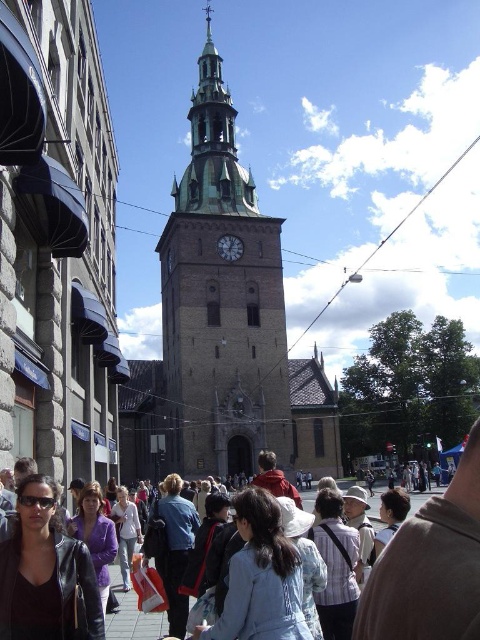
You are standing at the center of the street scene in front of the historic church. You see a matte black jacket at lower left. Can you determine its exact location using the coordinate system provided?

The matte black jacket at lower left is located at point (431,566).

You are a photographer trying to capture the entire brown stone church at center and the matte gray clock at center in a single photo. Given that your camera can only fit objects with a combined width of 10 meters, will you be able to include both in the frame?

The brown stone church at center is wider than the matte gray clock at center. Since the combined width of both objects would exceed the camera frame limit of 10 meters, it might not be possible to include both in the photo.